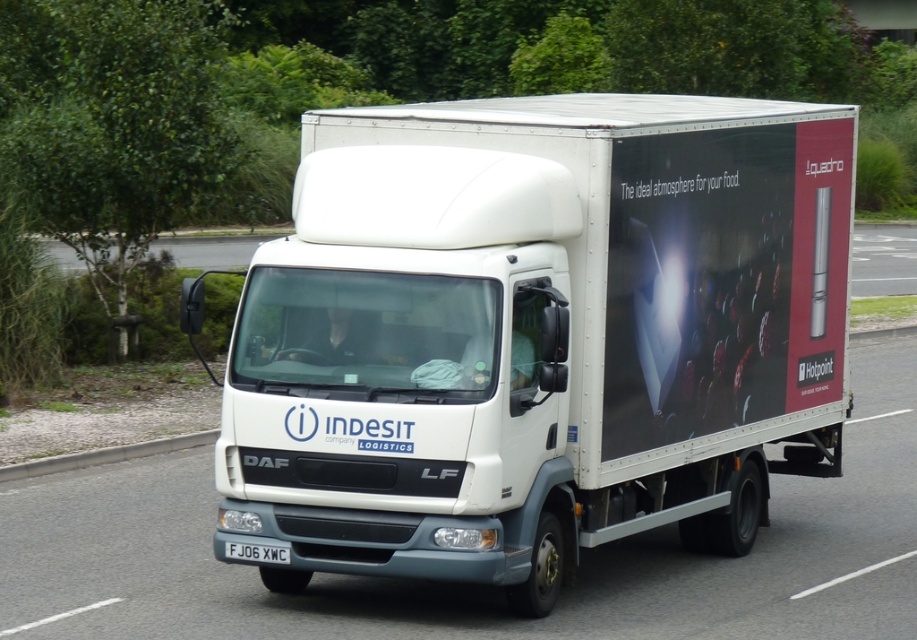
You are a traffic officer observing a white matte trailer truck at center and a white plastic license plate at center. Which object is located to the right of the other?

The white matte trailer truck at center is positioned on the right side of white plastic license plate at center.

In the scene shown: You are a delivery driver who needs to attach a new license plate to your white matte trailer truck at center. The new license plate must be placed exactly 7 inches away from the truck. Is the current white plastic license plate at center positioned correctly?

The white plastic license plate at center is 6.94 inches away from the white matte trailer truck at center, which is just slightly less than the required 7 inches. Therefore, it is not positioned correctly and needs adjustment to meet the 7 inch requirement.